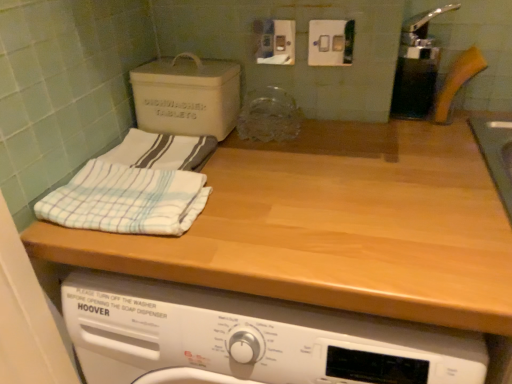
Locate an element on the screen. This screenshot has width=512, height=384. free space in front of white striped cloth at upper left, which is the 1th bath towel in back-to-front order is located at coordinates (177, 220).